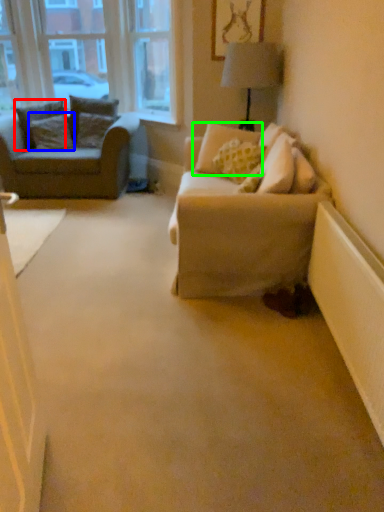
Question: Which object is positioned farthest from pillow (highlighted by a red box)? Select from pillow (highlighted by a blue box) and pillow (highlighted by a green box).

Choices:
 (A) pillow
 (B) pillow

Answer: (B)